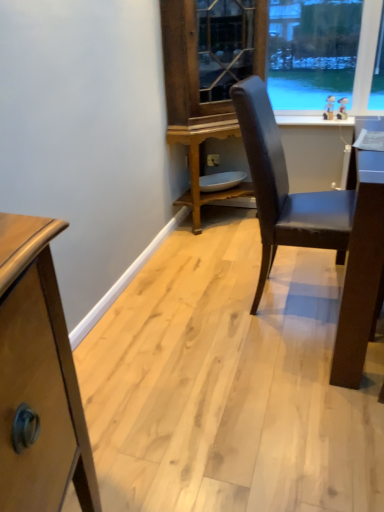
Question: Visually, is white plastic power outlet at center positioned to the left or to the right of wooden cabinet at center?

Choices:
 (A) left
 (B) right

Answer: (A)

Question: From a real-world perspective, is white plastic power outlet at center above or below wooden cabinet at center?

Choices:
 (A) above
 (B) below

Answer: (B)

Question: Estimate the real-world distances between objects in this image. Which object is farther from the matte black chair at center?

Choices:
 (A) wooden cabinet at center
 (B) white plastic power outlet at center
 (C) white glossy window sill at upper right

Answer: (B)

Question: Based on their relative distances, which object is farther from the matte black chair at center?

Choices:
 (A) wooden cabinet at center
 (B) white plastic power outlet at center
 (C) white glossy window sill at upper right

Answer: (B)